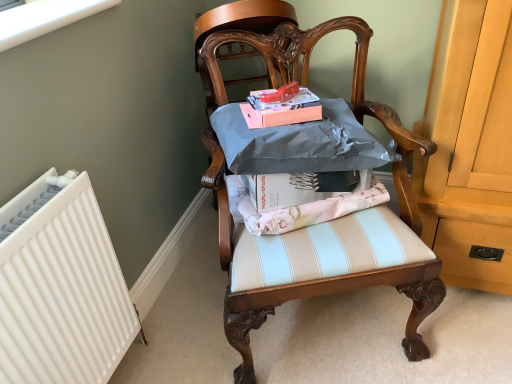
I want to click on matte silver wrapping paper at center, so click(296, 207).

This screenshot has width=512, height=384. Identify the location of matte pink magazine at center. (281, 109).

From a real-world perspective, which object stands above the other?

matte pink magazine at center, from a real-world perspective.

Considering the sizes of objects matte pink magazine at center and wooden chair at center in the image provided, who is thinner, matte pink magazine at center or wooden chair at center?

With smaller width is matte pink magazine at center.

In terms of height, does matte pink magazine at center look taller or shorter compared to wooden chair at center?

In the image, matte pink magazine at center appears to be shorter than wooden chair at center.

Locate an element on the screen. This screenshot has height=384, width=512. magazine that appears behind the wooden chair at center is located at coordinates (281, 109).

Can you confirm if wooden chair at center is shorter than matte pink magazine at center?

In fact, wooden chair at center may be taller than matte pink magazine at center.

Which is more to the right, wooden chair at center or matte pink magazine at center?

wooden chair at center is more to the right.

How many degrees apart are the facing directions of wooden chair at center and matte pink magazine at center?

The facing directions of wooden chair at center and matte pink magazine at center are 4.79 degrees apart.

Is wooden chair at center thinner than matte pink magazine at center?

No.

Where is `magazine above the matte silver wrapping paper at center (from a real-world perspective)`? The width and height of the screenshot is (512, 384). magazine above the matte silver wrapping paper at center (from a real-world perspective) is located at coordinates (281, 109).

From the picture: Which object is further away from the camera, matte silver wrapping paper at center or matte pink magazine at center?

matte silver wrapping paper at center.

Which is closer, (368, 199) or (247, 120)?

The point (247, 120) is more forward.

Between matte silver wrapping paper at center and matte pink magazine at center, which one appears on the right side from the viewer's perspective?

From the viewer's perspective, matte silver wrapping paper at center appears more on the right side.

Is matte silver wrapping paper at center thinner than wooden chair at center?

Yes.

Considering the points (225, 177) and (330, 31), which point is in front, point (225, 177) or point (330, 31)?

Point (225, 177)

Do you think matte silver wrapping paper at center is within wooden chair at center, or outside of it?

matte silver wrapping paper at center can be found inside wooden chair at center.

From a real-world perspective, is wooden chair at center over matte silver wrapping paper at center?

Incorrect, from a real-world perspective, wooden chair at center is lower than matte silver wrapping paper at center.

Considering the sizes of wooden chair at center and matte silver wrapping paper at center in the image, is wooden chair at center bigger or smaller than matte silver wrapping paper at center?

In the image, wooden chair at center appears to be larger than matte silver wrapping paper at center.

Which is behind, point (236, 345) or point (253, 207)?

The point (253, 207) is more distant.

Considering the relative sizes of matte pink magazine at center and matte silver wrapping paper at center in the image provided, is matte pink magazine at center smaller than matte silver wrapping paper at center?

Correct, matte pink magazine at center occupies less space than matte silver wrapping paper at center.

Which object is further away from the camera taking this photo, matte pink magazine at center or matte silver wrapping paper at center?

Positioned behind is matte silver wrapping paper at center.

How many degrees apart are the facing directions of matte pink magazine at center and matte silver wrapping paper at center?

There is a 13.3-degree angle between the facing directions of matte pink magazine at center and matte silver wrapping paper at center.

Which object is positioned more to the right, matte pink magazine at center or matte silver wrapping paper at center?

matte silver wrapping paper at center.

In the image, there is a matte pink magazine at center. At what (x,y) coordinates should I click in order to perform the action: click on chair below it (from the image's perspective). Please return your answer as a coordinate pair (x, y). This screenshot has width=512, height=384. Looking at the image, I should click on point(309,283).

What are the coordinates of `magazine on the left of wooden chair at center` in the screenshot? It's located at (281, 109).

In the scene shown: Estimate the real-world distances between objects in this image. Which object is closer to wooden chair at center, matte silver wrapping paper at center or matte pink magazine at center?

matte silver wrapping paper at center lies closer to wooden chair at center than the other object.

Looking at the image, which one is located closer to matte pink magazine at center, wooden chair at center or matte silver wrapping paper at center?

The object closer to matte pink magazine at center is matte silver wrapping paper at center.

From the image, which object appears to be nearer to wooden chair at center, matte pink magazine at center or matte silver wrapping paper at center?

Based on the image, matte silver wrapping paper at center appears to be nearer to wooden chair at center.

From the image, which object appears to be nearer to matte silver wrapping paper at center, wooden chair at center or matte pink magazine at center?

The object closer to matte silver wrapping paper at center is wooden chair at center.

Based on their spatial positions, is matte silver wrapping paper at center or wooden chair at center further from matte pink magazine at center?

wooden chair at center is further to matte pink magazine at center.

From the image, which object appears to be nearer to matte silver wrapping paper at center, matte pink magazine at center or wooden chair at center?

wooden chair at center is positioned closer to the anchor matte silver wrapping paper at center.

Locate an element on the screen. The image size is (512, 384). magazine between wooden chair at center and matte silver wrapping paper at center in the front-back direction is located at coordinates (281, 109).